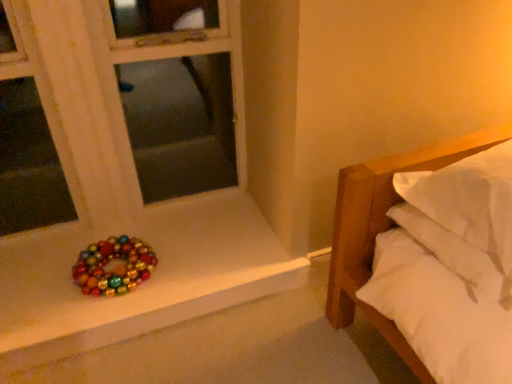
This screenshot has height=384, width=512. I want to click on free space above glossy multicolored beads at lower left (from a real-world perspective), so click(95, 261).